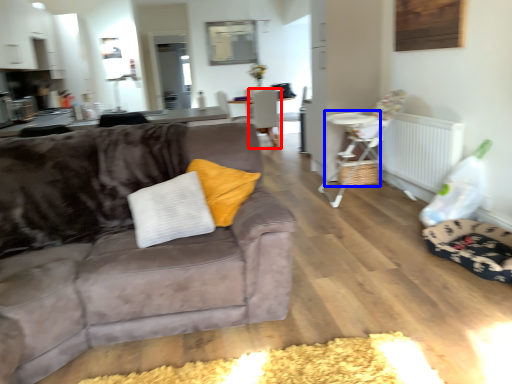
Question: Among these objects, which one is nearest to the camera, chair (highlighted by a red box) or table (highlighted by a blue box)?

Choices:
 (A) chair
 (B) table

Answer: (B)